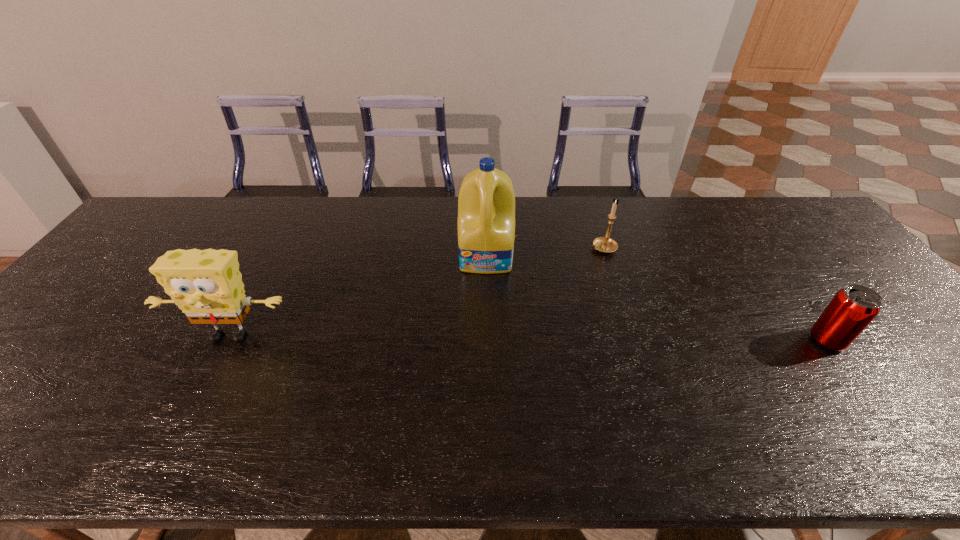
Identify the location of free space on the desktop that is between the leftmost object and the soda can and is positioned on the label of the third object from right to left. The width and height of the screenshot is (960, 540). (485, 338).

I want to click on vacant space on the desktop that is between the sponge and the soda can and is positioned on the handle side of the candle holder, so [449, 338].